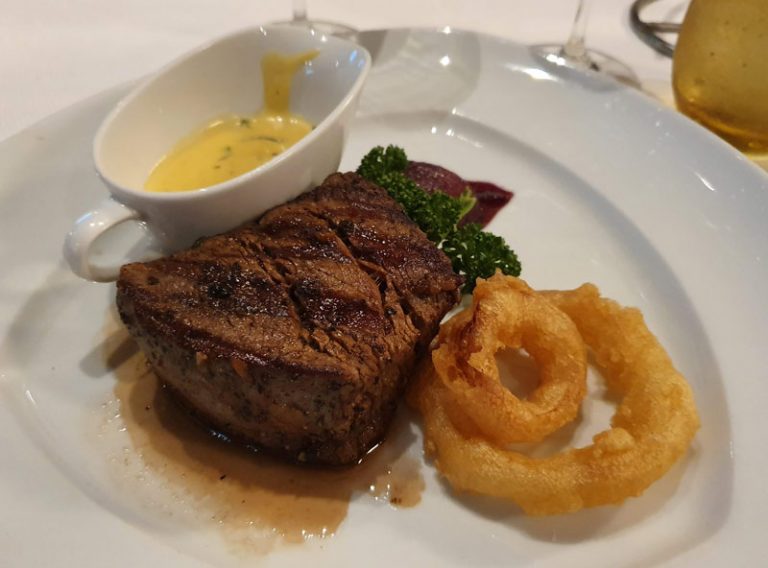
Find the location of a particular element. white sauce bowl is located at coordinates (164, 96).